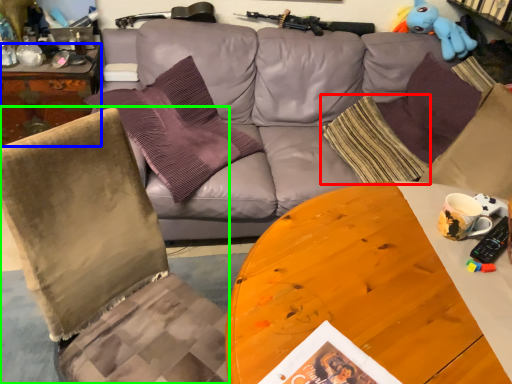
Question: Considering the real-world distances, which object is farthest from pillow (highlighted by a red box)? desk (highlighted by a blue box) or chair (highlighted by a green box)?

Choices:
 (A) desk
 (B) chair

Answer: (A)